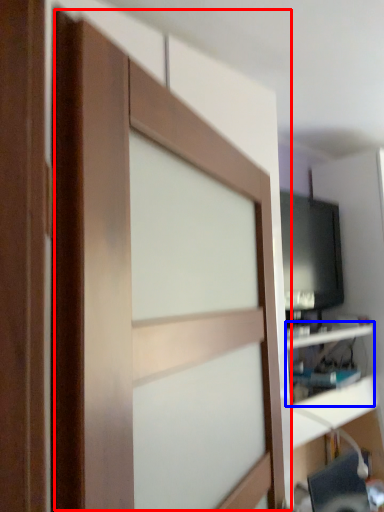
Question: Among these objects, which one is nearest to the camera, barn door (highlighted by a red box) or shelf (highlighted by a blue box)?

Choices:
 (A) barn door
 (B) shelf

Answer: (A)